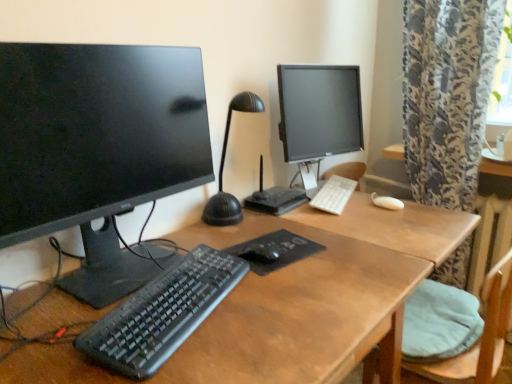
Locate an element on the screen. The height and width of the screenshot is (384, 512). vacant area in front of white plastic keyboard at center, which appears as the second computer keyboard when viewed from the front is located at coordinates (352, 218).